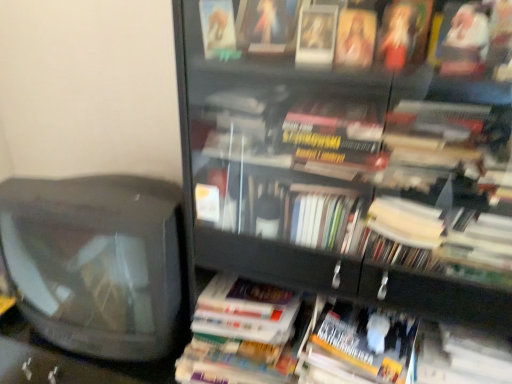
Question: Relative to transparent glass bookcase at center, is hardcover book at center, positioned as the 1th paperback book in left-to-right order, in front or behind?

Choices:
 (A) front
 (B) behind

Answer: (B)

Question: Is hardcover book at center, arranged as the 2th paperback book when viewed from the right, situated inside transparent glass bookcase at center or outside?

Choices:
 (A) outside
 (B) inside

Answer: (B)

Question: Based on their relative distances, which object is nearer to the transparent glass bookcase at center?

Choices:
 (A) hardcover book at center, positioned as the 1th paperback book in left-to-right order
 (B) yellow matte paperback book at lower right, which appears as the first paperback book when viewed from the right

Answer: (B)

Question: Estimate the real-world distances between objects in this image. Which object is farther from the transparent glass bookcase at center?

Choices:
 (A) yellow matte paperback book at lower right, which is the 2th paperback book from left to right
 (B) hardcover book at center, positioned as the 1th paperback book in left-to-right order

Answer: (B)